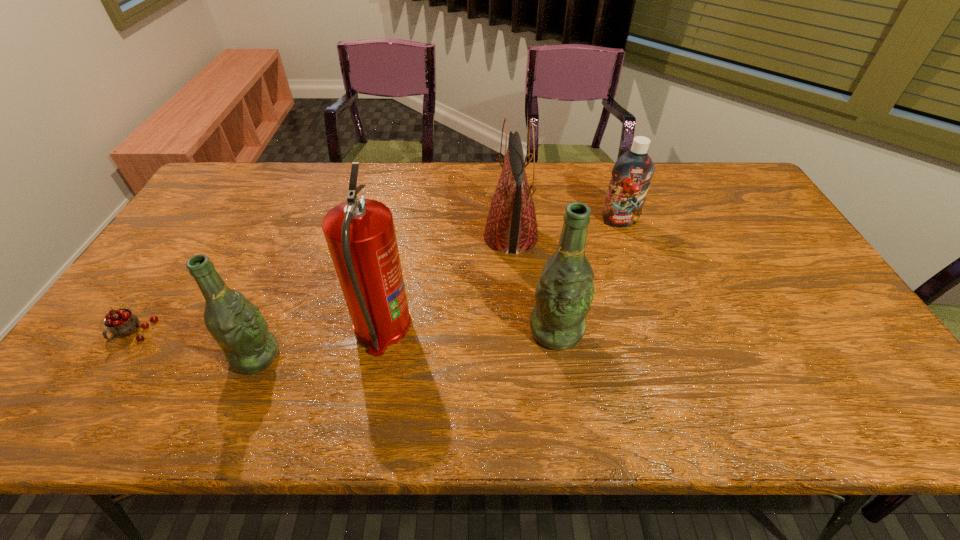
Identify the location of the shorter beer bottle. Image resolution: width=960 pixels, height=540 pixels. (237, 325).

This screenshot has height=540, width=960. I want to click on the second object from left to right, so click(237, 325).

Locate an element on the screen. the taller beer bottle is located at coordinates (564, 293).

The width and height of the screenshot is (960, 540). I want to click on shampoo, so click(x=631, y=175).

This screenshot has height=540, width=960. Find the location of `handbag`. handbag is located at coordinates (511, 226).

In order to click on the third object from left to right in this screenshot , I will do `click(360, 234)`.

At what (x,y) coordinates should I click in order to perform the action: click on the leftmost object. Please return your answer as a coordinate pair (x, y). Looking at the image, I should click on (121, 323).

This screenshot has height=540, width=960. I want to click on cherry, so click(x=121, y=323).

The width and height of the screenshot is (960, 540). What are the coordinates of `free spot located on the surface of the shorter beer bottle` in the screenshot? It's located at (408, 356).

Find the location of a particular element. vacant space located 0.050m on the surface of the right beer bottle is located at coordinates (563, 372).